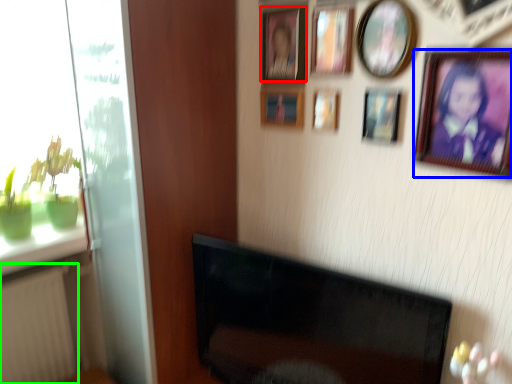
Question: Which object is the closest to the picture frame (highlighted by a red box)? Choose among these: picture frame (highlighted by a blue box) or radiator (highlighted by a green box).

Choices:
 (A) picture frame
 (B) radiator

Answer: (A)